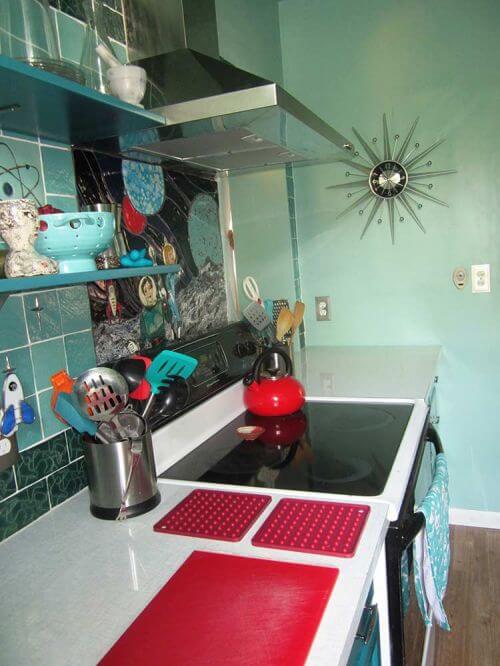
The width and height of the screenshot is (500, 666). I want to click on induction hob, so click(366, 439).